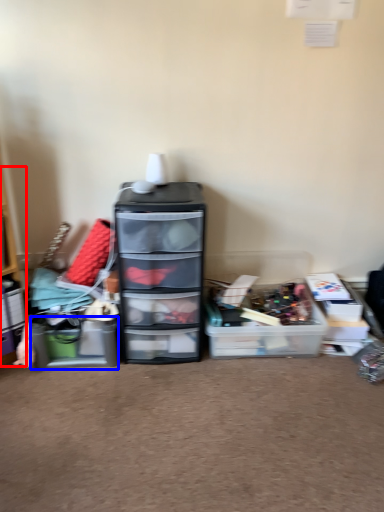
Question: Which object is further to the camera taking this photo, shelf (highlighted by a red box) or storage box (highlighted by a blue box)?

Choices:
 (A) shelf
 (B) storage box

Answer: (B)